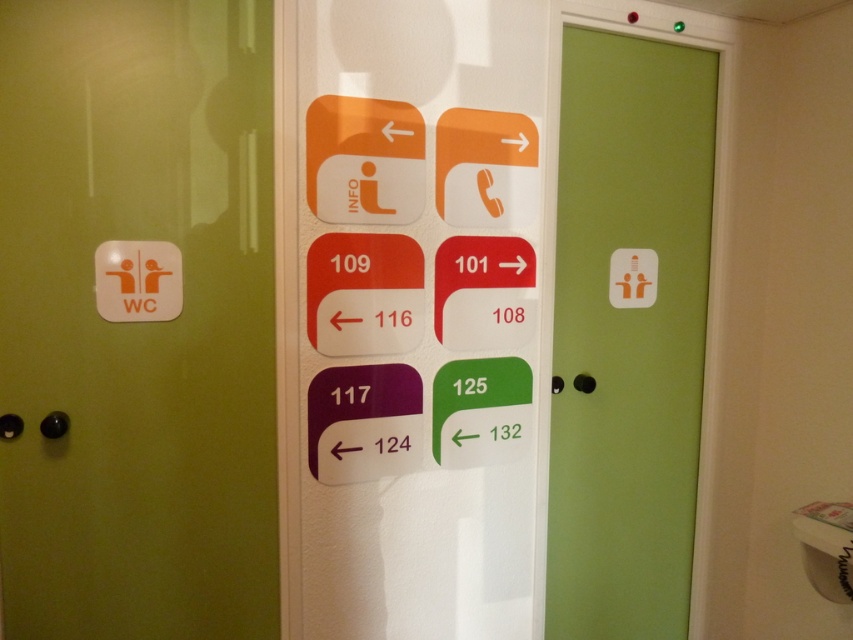
Question: Which of the following is the farthest from the observer?

Choices:
 (A) (78, 74)
 (B) (576, 259)

Answer: (B)

Question: Does green matte wc sign at left appear on the right side of green matte door at center?

Choices:
 (A) no
 (B) yes

Answer: (A)

Question: Which object is farther from the camera taking this photo?

Choices:
 (A) green matte wc sign at left
 (B) green matte door at center

Answer: (B)

Question: Observing the image, what is the correct spatial positioning of green matte wc sign at left in reference to green matte door at center?

Choices:
 (A) below
 (B) above

Answer: (B)

Question: Is green matte wc sign at left positioned at the back of green matte door at center?

Choices:
 (A) yes
 (B) no

Answer: (B)